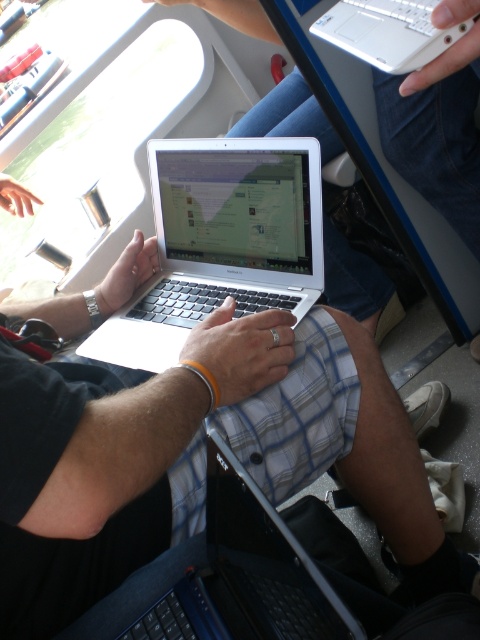
Question: Is silver metallic laptop at center further to camera compared to white plastic laptop at upper center?

Choices:
 (A) yes
 (B) no

Answer: (A)

Question: Which object appears farthest from the camera in this image?

Choices:
 (A) black matte laptop at center
 (B) silver metallic laptop at center
 (C) white plastic laptop at upper center

Answer: (B)

Question: Does silver metallic laptop at center appear over white plastic laptop at upper center?

Choices:
 (A) no
 (B) yes

Answer: (A)

Question: Which point appears farthest from the camera in this image?

Choices:
 (A) (196, 593)
 (B) (151, 179)

Answer: (B)

Question: Which object is positioned farthest from the white plastic laptop at upper center?

Choices:
 (A) silver metallic laptop at center
 (B) black matte laptop at center

Answer: (B)

Question: Does silver metallic laptop at center come in front of white plastic laptop at upper center?

Choices:
 (A) yes
 (B) no

Answer: (B)